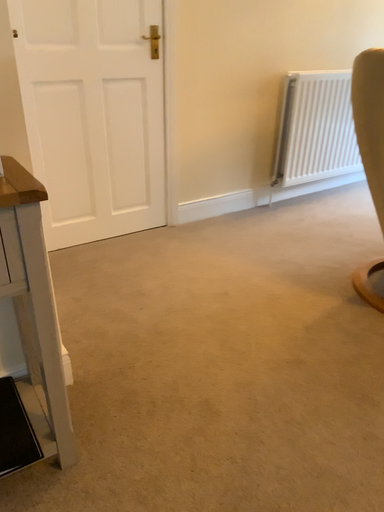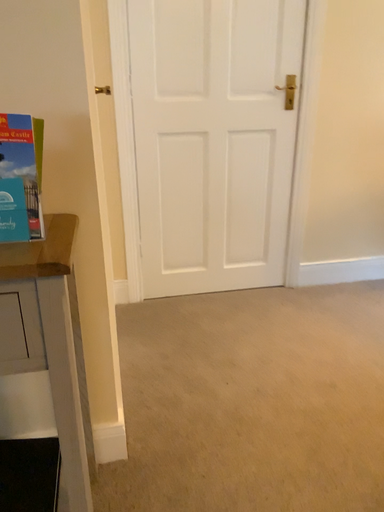
Question: Which way did the camera rotate in the video?

Choices:
 (A) rotated upward
 (B) rotated downward

Answer: (A)